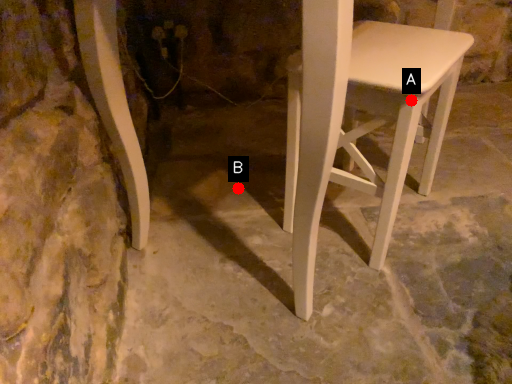
Question: Two points are circled on the image, labeled by A and B beside each circle. Which point appears closest to the camera in this image?

Choices:
 (A) A is closer
 (B) B is closer

Answer: (A)